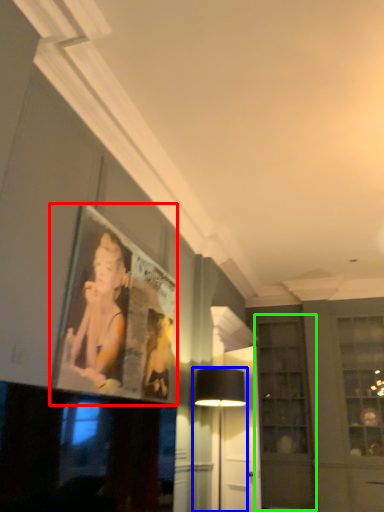
Question: Considering the real-world distances, which object is farthest from picture frame (highlighted by a red box)? table lamp (highlighted by a blue box) or glass door (highlighted by a green box)?

Choices:
 (A) table lamp
 (B) glass door

Answer: (B)